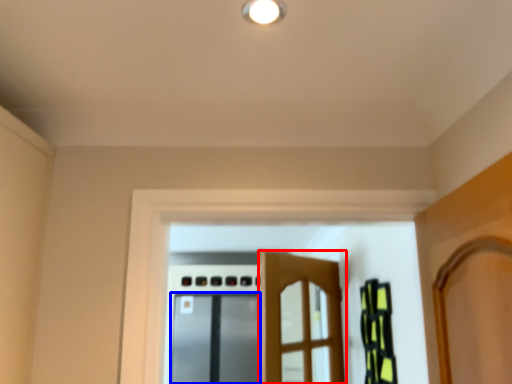
Question: Among these objects, which one is nearest to the camera, door (highlighted by a red box) or screen door (highlighted by a blue box)?

Choices:
 (A) door
 (B) screen door

Answer: (A)